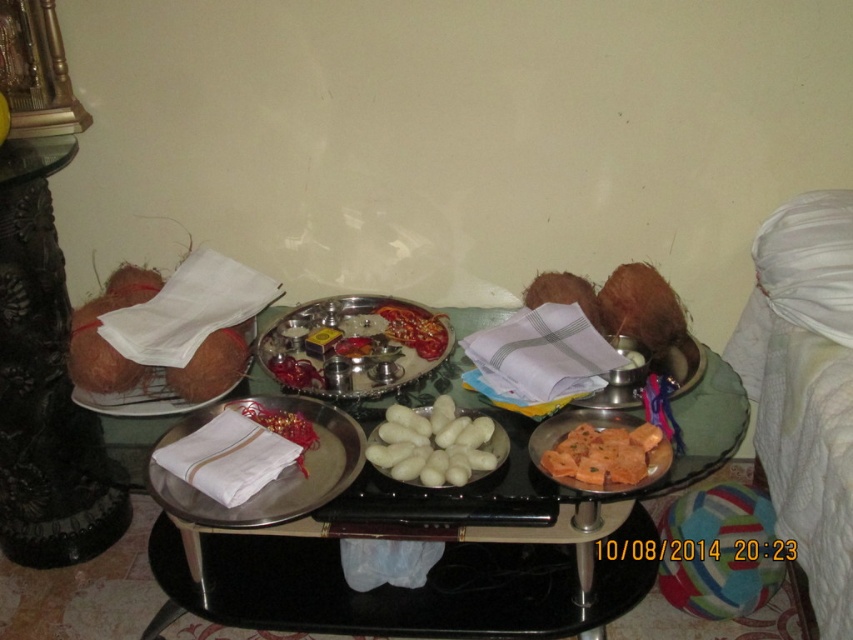
You are standing at the edge of the table looking towards the wall. Which of the two points, point (460, 557) or point (363, 436), is closer to the wall?

Point (460, 557) is behind point (363, 436), so it is closer to the wall.

Where is the metallic silver tray at center located on the table?

The metallic silver tray at center is located at point (433,566) on the table.